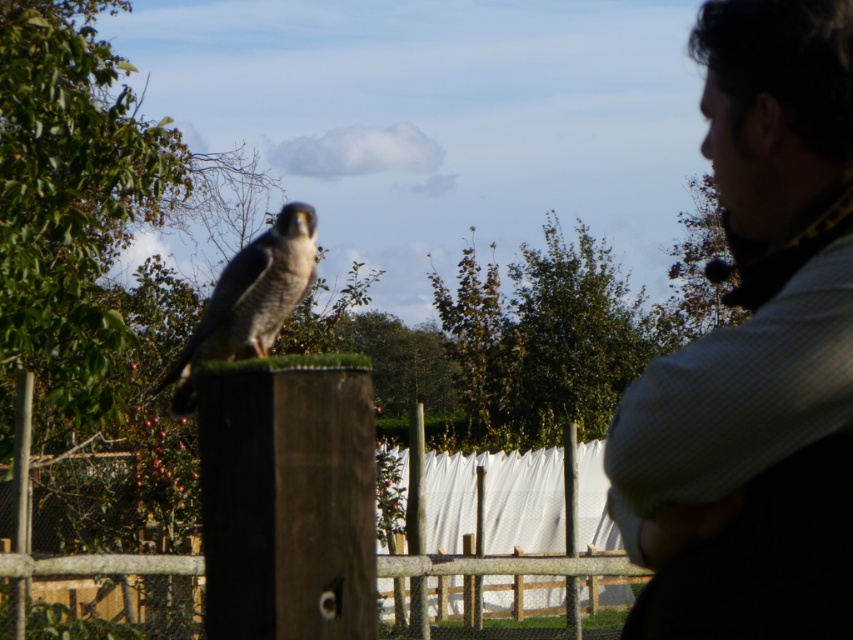
You are standing at the center of the image and want to place a new object at the exact center of the image. The checkered fabric shirt at right is located at point 0.553 on the x axis and 0.887 on the y axis. Where should you place the new object to ensure it is centered?

The new object should be placed at the center coordinates of the image, which is typically at point 0.5 on both the x and y axes. Since the checkered fabric shirt at right is at [756,353], placing the new object at [426,320] will ensure it is centered.

You are a photographer standing at the camera position. You want to take a closeup shot of the checkered fabric shirt at right. Can you step forward to get closer to it without moving the shirt? Explain why or why not.

The checkered fabric shirt at right is 2.52 meters away from the camera. Since you can move forward, you can reduce the distance to achieve a closer shot.

You are standing in the scene and want to take a photo of the point at coordinates point (x=666, y=588). Your camera has a focal length of 50mm and you are currently 10 feet away from the point. Do you need to move closer or farther to focus properly?

The distance of point (x=666, y=588) from camera is 8.46 feet. Since you are currently 10 feet away from the point, which is farther than the required distance, you need to move closer to 8.46 feet to focus properly.